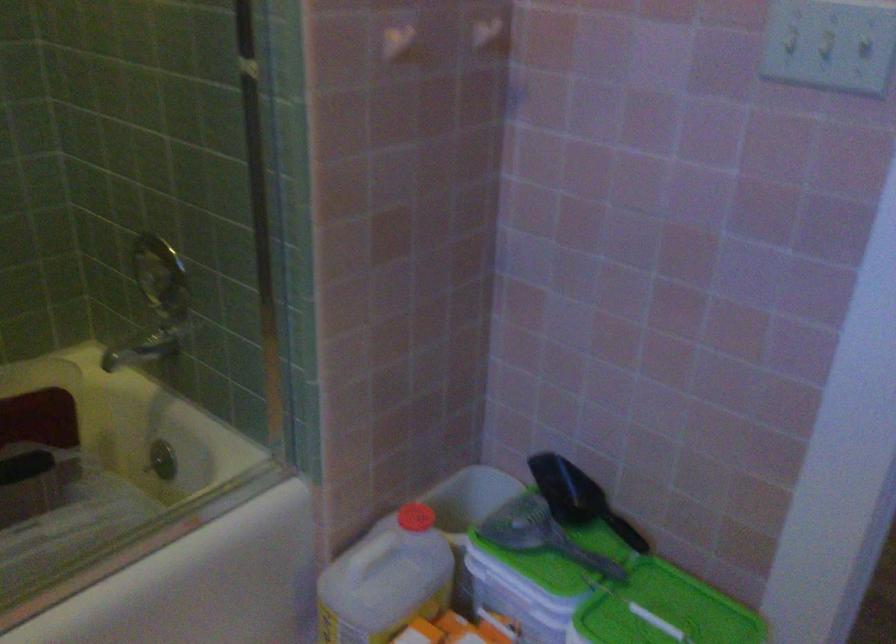
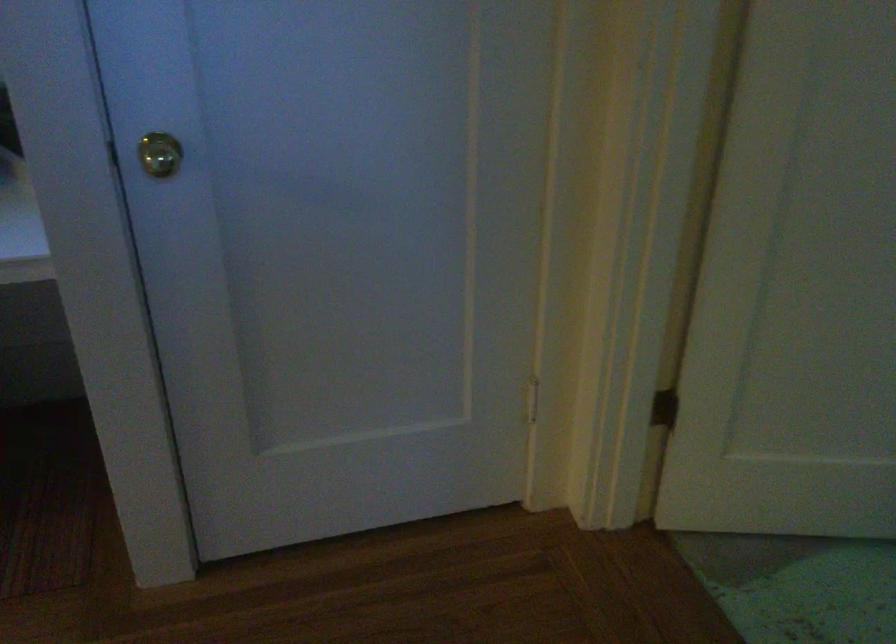
The images are taken continuously from a first-person perspective. In which direction is your viewpoint rotating?

The camera rotated toward right-down.